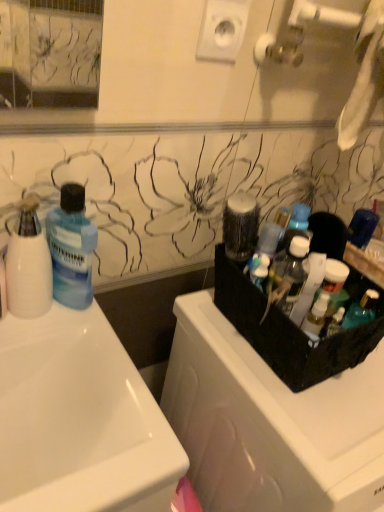
Question: Is translucent plastic container at upper right to the left of white glossy sink at left from the viewer's perspective?

Choices:
 (A) yes
 (B) no

Answer: (B)

Question: From a real-world perspective, is translucent plastic container at upper right below white glossy sink at left?

Choices:
 (A) no
 (B) yes

Answer: (A)

Question: Does translucent plastic container at upper right have a greater width compared to white glossy sink at left?

Choices:
 (A) no
 (B) yes

Answer: (A)

Question: Does translucent plastic container at upper right have a lesser height compared to white glossy sink at left?

Choices:
 (A) no
 (B) yes

Answer: (B)

Question: From the image's perspective, is translucent plastic container at upper right on white glossy sink at left?

Choices:
 (A) no
 (B) yes

Answer: (B)

Question: Is translucent plastic container at upper right aimed at white glossy sink at left?

Choices:
 (A) yes
 (B) no

Answer: (B)

Question: Does translucent plastic bottles at right, which appears as the 2th cleaning product when viewed from the left, have a larger size compared to translucent plastic container at upper right?

Choices:
 (A) no
 (B) yes

Answer: (B)

Question: Is translucent plastic bottles at right, which appears as the 2th cleaning product when viewed from the left, shorter than translucent plastic container at upper right?

Choices:
 (A) no
 (B) yes

Answer: (A)

Question: Is translucent plastic bottles at right, placed as the 1th cleaning product when sorted from right to left, aimed at translucent plastic container at upper right?

Choices:
 (A) no
 (B) yes

Answer: (A)

Question: Can you confirm if translucent plastic bottles at right, placed as the 1th cleaning product when sorted from right to left, is positioned to the right of translucent plastic container at upper right?

Choices:
 (A) yes
 (B) no

Answer: (A)

Question: From a real-world perspective, does translucent plastic bottles at right, which appears as the 2th cleaning product when viewed from the left, stand above translucent plastic container at upper right?

Choices:
 (A) no
 (B) yes

Answer: (A)

Question: Is translucent plastic bottles at right, which appears as the 2th cleaning product when viewed from the left, positioned in front of translucent plastic container at upper right?

Choices:
 (A) no
 (B) yes

Answer: (B)

Question: From a real-world perspective, is translucent plastic container at upper right physically below translucent plastic bottles at right, placed as the 1th cleaning product when sorted from right to left?

Choices:
 (A) yes
 (B) no

Answer: (B)